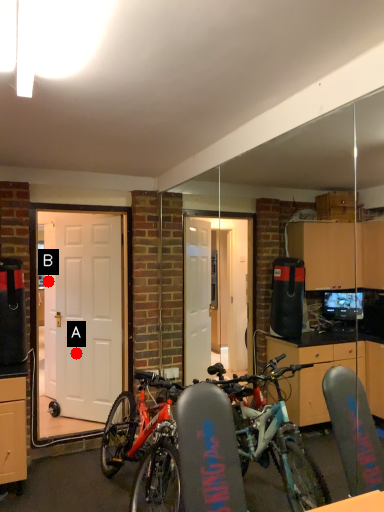
Question: Two points are circled on the image, labeled by A and B beside each circle. Which point is further to the camera?

Choices:
 (A) A is further
 (B) B is further

Answer: (B)